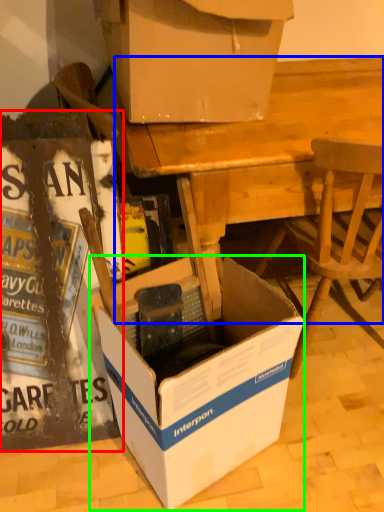
Question: Considering the real-world distances, which object is farthest from box (highlighted by a red box)? desk (highlighted by a blue box) or box (highlighted by a green box)?

Choices:
 (A) desk
 (B) box

Answer: (A)